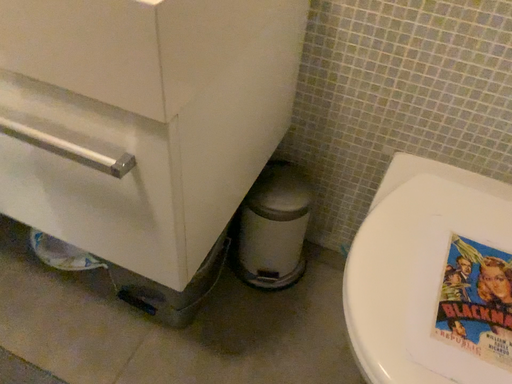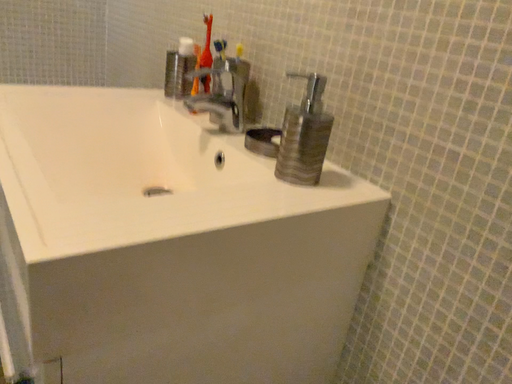
Question: How did the camera likely rotate when shooting the video?

Choices:
 (A) rotated left
 (B) rotated right

Answer: (A)